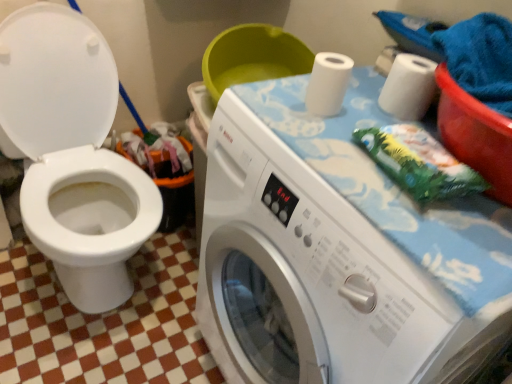
Where is `free space in front of white matte toilet paper at upper right, the 2th toilet paper in the right-to-left sequence`? The width and height of the screenshot is (512, 384). free space in front of white matte toilet paper at upper right, the 2th toilet paper in the right-to-left sequence is located at coordinates (319, 144).